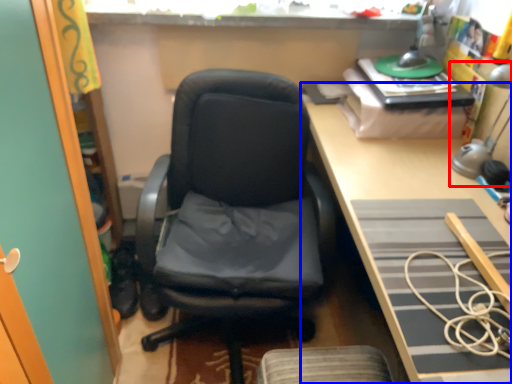
Question: Which point is further to the camera, table lamp (highlighted by a red box) or desk (highlighted by a blue box)?

Choices:
 (A) table lamp
 (B) desk

Answer: (A)